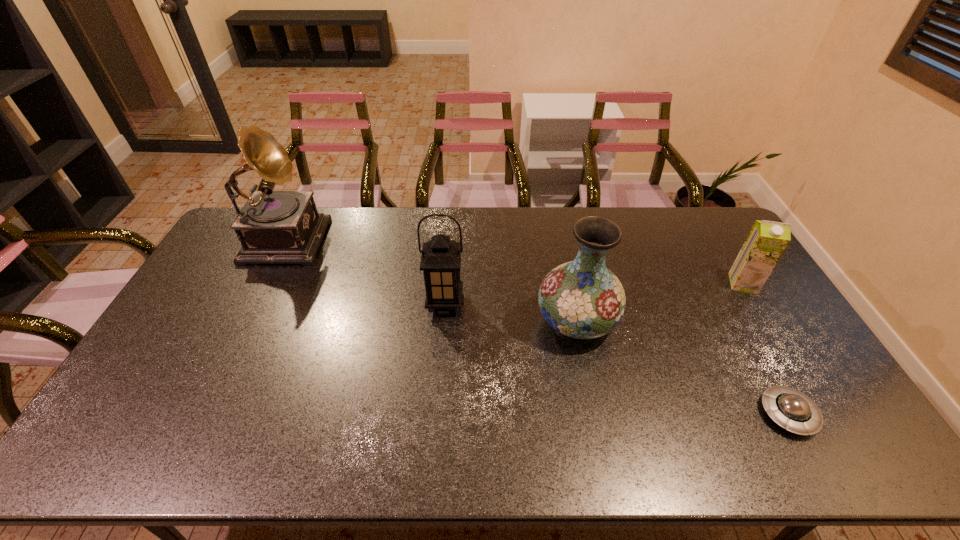
In the image, there is a desktop. Where is `vacant space at the left edge`? This screenshot has height=540, width=960. vacant space at the left edge is located at coordinates (209, 289).

Find the location of `vacant space at the right edge of the desktop`. vacant space at the right edge of the desktop is located at coordinates (781, 352).

This screenshot has width=960, height=540. I want to click on vacant area at the far right corner of the desktop, so click(x=722, y=224).

Where is `vacant point located between the second object from left to right and the vase`? This screenshot has height=540, width=960. vacant point located between the second object from left to right and the vase is located at coordinates (511, 312).

Identify the location of blank region between the soya milk and the record player. The height and width of the screenshot is (540, 960). (515, 260).

Where is `free space that is in between the soya milk and the third object from left to right`? The width and height of the screenshot is (960, 540). free space that is in between the soya milk and the third object from left to right is located at coordinates (660, 302).

Identify the location of free space between the soya milk and the vase. This screenshot has height=540, width=960. (660, 302).

I want to click on free spot between the record player and the lantern, so click(x=366, y=269).

Find the location of `free point between the fourth object from right to left and the farthest object`. free point between the fourth object from right to left and the farthest object is located at coordinates (366, 269).

Choose which object is the second nearest neighbor to the third object from left to right. Please provide its 2D coordinates. Your answer should be formatted as a tuple, i.e. [(x, y)], where the tuple contains the x and y coordinates of a point satisfying the conditions above.

[(791, 409)]